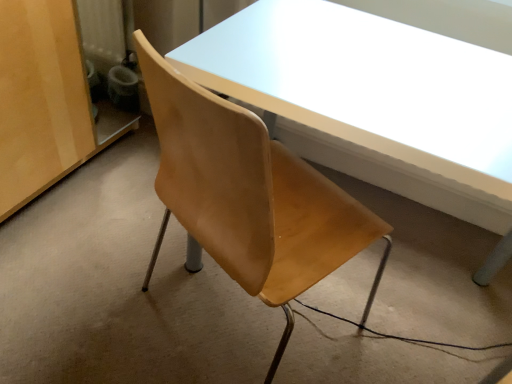
Locate an element on the screen. This screenshot has height=384, width=512. free point above wooden chair at center (from a real-world perspective) is located at coordinates (192, 275).